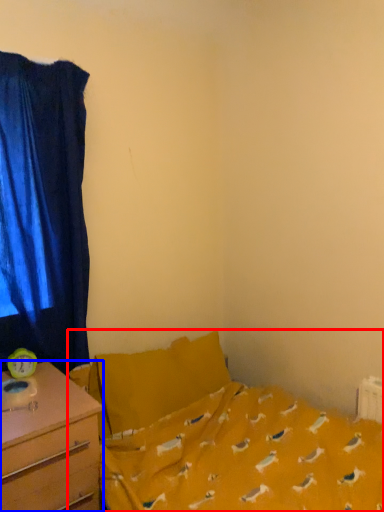
Question: Which object appears farthest to the camera in this image, bed (highlighted by a red box) or desk (highlighted by a blue box)?

Choices:
 (A) bed
 (B) desk

Answer: (A)